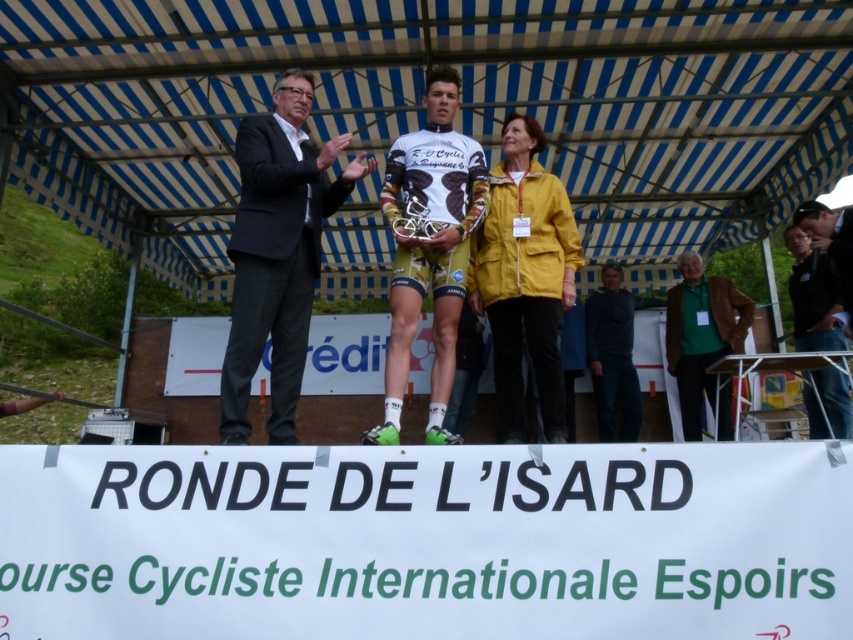
Question: Can you confirm if white jersey at center is positioned to the left of green fabric shirt at lower right?

Choices:
 (A) yes
 (B) no

Answer: (A)

Question: Which object is positioned farthest from the white jersey at center?

Choices:
 (A) yellow fabric jacket at center
 (B) green fabric shirt at lower right
 (C) black fabric jacket at lower right

Answer: (C)

Question: Where is yellow fabric jacket at center located in relation to black fabric jacket at lower right in the image?

Choices:
 (A) right
 (B) left

Answer: (B)

Question: Which object appears farthest from the camera in this image?

Choices:
 (A) green fabric shirt at lower right
 (B) black fabric jacket at lower right

Answer: (A)

Question: Does yellow fabric jacket at center have a lesser width compared to black fabric jacket at lower right?

Choices:
 (A) no
 (B) yes

Answer: (A)

Question: Which of the following is the closest to the observer?

Choices:
 (A) yellow fabric jacket at center
 (B) white jersey at center

Answer: (B)